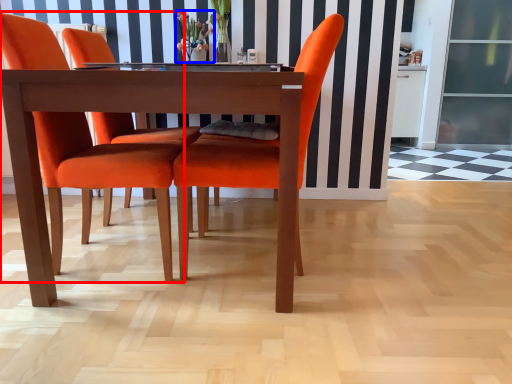
Question: Among these objects, which one is farthest to the camera, chair (highlighted by a red box) or floral arrangement (highlighted by a blue box)?

Choices:
 (A) chair
 (B) floral arrangement

Answer: (B)